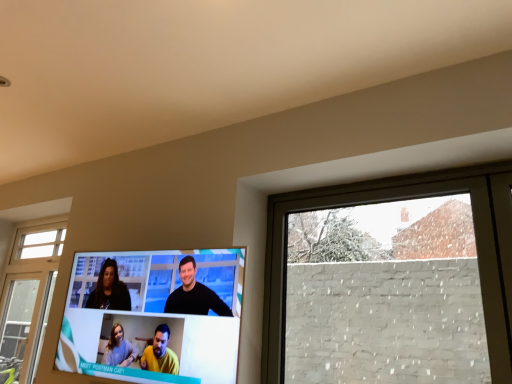
I want to click on matte black television at center, so click(153, 316).

The image size is (512, 384). Describe the element at coordinates (153, 316) in the screenshot. I see `matte black television at center` at that location.

Where is `white brick wall at right`? The image size is (512, 384). white brick wall at right is located at coordinates (368, 203).

What do you see at coordinates (368, 203) in the screenshot? This screenshot has height=384, width=512. I see `white brick wall at right` at bounding box center [368, 203].

The image size is (512, 384). I want to click on matte black television at center, so click(153, 316).

Does matte black television at center appear on the right side of white brick wall at right?

No, matte black television at center is not to the right of white brick wall at right.

Does matte black television at center lie behind white brick wall at right?

Yes, matte black television at center is behind white brick wall at right.

Is point (119, 378) positioned before point (379, 194)?

Yes, point (119, 378) is closer to viewer.

From the image's perspective, does matte black television at center appear lower than white brick wall at right?

Correct, matte black television at center appears lower than white brick wall at right in the image.

From a real-world perspective, which is physically below, matte black television at center or white brick wall at right?

From a 3D spatial view, matte black television at center is below.

Can you confirm if matte black television at center is thinner than white brick wall at right?

No, matte black television at center is not thinner than white brick wall at right.

Considering the relative sizes of matte black television at center and white brick wall at right in the image provided, is matte black television at center taller than white brick wall at right?

No, matte black television at center is not taller than white brick wall at right.

Considering the sizes of matte black television at center and white brick wall at right in the image, is matte black television at center bigger or smaller than white brick wall at right?

In the image, matte black television at center appears to be larger than white brick wall at right.

Is matte black television at center outside of white brick wall at right?

Indeed, matte black television at center is completely outside white brick wall at right.

Are matte black television at center and white brick wall at right far apart?

Actually, matte black television at center and white brick wall at right are a little close together.

Does matte black television at center turn towards white brick wall at right?

No, matte black television at center is not aimed at white brick wall at right.

At what (x,y) coordinates should I click in order to perform the action: click on television located on the left of white brick wall at right. Please return your answer as a coordinate pair (x, y). Looking at the image, I should click on (153, 316).

Can you confirm if white brick wall at right is positioned to the left of matte black television at center?

No.

Which object is further away from the camera taking this photo, white brick wall at right or matte black television at center?

matte black television at center.

Is point (501, 211) more distant than point (81, 261)?

That is False.

From the image's perspective, is white brick wall at right above matte black television at center?

Indeed, from the image's perspective, white brick wall at right is shown above matte black television at center.

From a real-world perspective, between white brick wall at right and matte black television at center, who is vertically lower?

In real-world perspective, matte black television at center is lower.

Is white brick wall at right wider than matte black television at center?

Incorrect, the width of white brick wall at right does not surpass that of matte black television at center.

Can you confirm if white brick wall at right is shorter than matte black television at center?

No.

Which of these two, white brick wall at right or matte black television at center, is smaller?

white brick wall at right is smaller.

Is white brick wall at right completely or partially outside of matte black television at center?

Indeed, white brick wall at right is completely outside matte black television at center.

Is there a large distance between white brick wall at right and matte black television at center?

white brick wall at right is actually quite close to matte black television at center.

Does white brick wall at right turn towards matte black television at center?

No, white brick wall at right is not turned towards matte black television at center.

How far apart are white brick wall at right and matte black television at center?

23.19 inches.

Locate an element on the screen. The height and width of the screenshot is (384, 512). window above the matte black television at center (from the image's perspective) is located at coordinates (368, 203).

Image resolution: width=512 pixels, height=384 pixels. Identify the location of television that appears behind the white brick wall at right. (153, 316).

In the image, there is a white brick wall at right. Where is `television below it (from the image's perspective)`? This screenshot has width=512, height=384. television below it (from the image's perspective) is located at coordinates (153, 316).